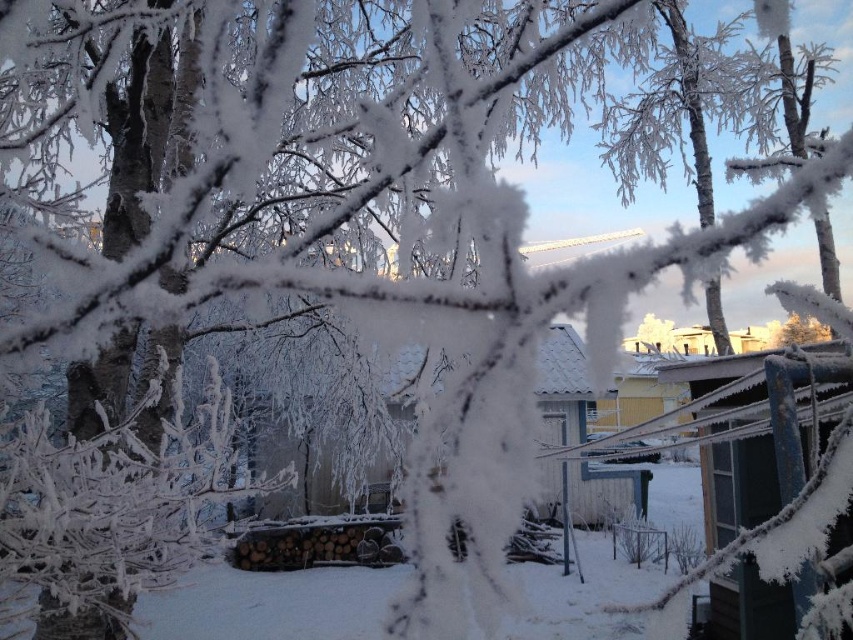
Measure the distance between blue painted wood hut at right and white wooden hut at center.

blue painted wood hut at right and white wooden hut at center are 5.36 meters apart from each other.

Looking at this image, is blue painted wood hut at right below white wooden hut at center?

Incorrect, blue painted wood hut at right is not positioned below white wooden hut at center.

At what (x,y) coordinates should I click in order to perform the action: click on blue painted wood hut at right. Please return your answer as a coordinate pair (x, y). Looking at the image, I should click on (744, 442).